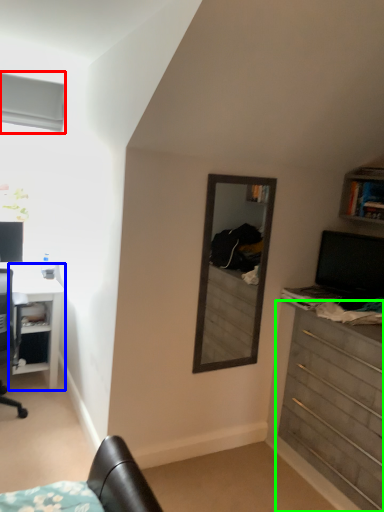
Question: Based on their relative distances, which object is farther from window (highlighted by a red box)? Choose from desk (highlighted by a blue box) and chest of drawers (highlighted by a green box).

Choices:
 (A) desk
 (B) chest of drawers

Answer: (B)